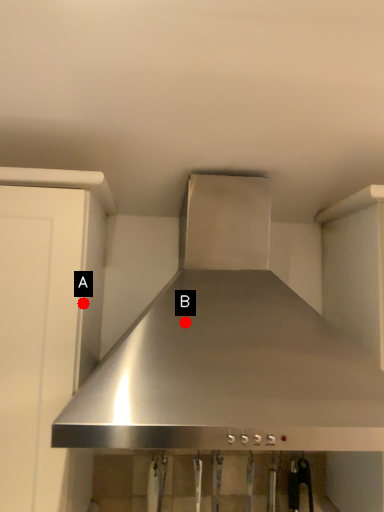
Question: Two points are circled on the image, labeled by A and B beside each circle. Which point is farther from the camera taking this photo?

Choices:
 (A) A is further
 (B) B is further

Answer: (A)